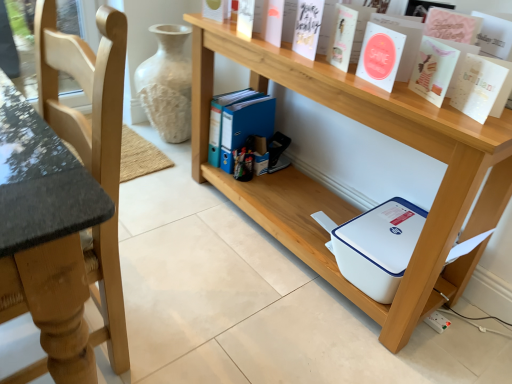
Where is `free space in front of white matte paper at upper center, the fourth paperback book viewed from the right`? The image size is (512, 384). free space in front of white matte paper at upper center, the fourth paperback book viewed from the right is located at coordinates (362, 84).